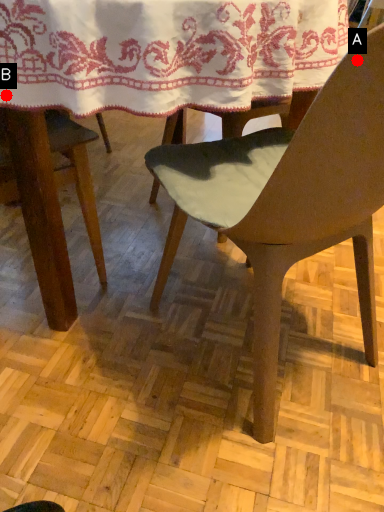
Question: Two points are circled on the image, labeled by A and B beside each circle. Which point is farther from the camera taking this photo?

Choices:
 (A) A is further
 (B) B is further

Answer: (B)